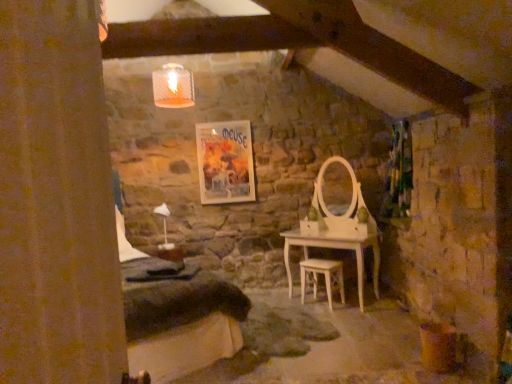
The height and width of the screenshot is (384, 512). What do you see at coordinates (225, 162) in the screenshot?
I see `matte paper poster at center` at bounding box center [225, 162].

What is the approximate width of green floral fabric curtain at right, the first curtain positioned from the back?

The width of green floral fabric curtain at right, the first curtain positioned from the back, is 13.10 inches.

This screenshot has width=512, height=384. What do you see at coordinates (56, 201) in the screenshot?
I see `brown textured curtain at left, which ranks as the 1th curtain in left-to-right order` at bounding box center [56, 201].

At what (x,y) coordinates should I click in order to perform the action: click on brown textured curtain at left, which is the second curtain in back-to-front order. Please return your answer as a coordinate pair (x, y). The width and height of the screenshot is (512, 384). Looking at the image, I should click on (56, 201).

This screenshot has height=384, width=512. Find the location of `matte paper poster at center`. matte paper poster at center is located at coordinates (225, 162).

Who is more distant, matte paper poster at center or green floral fabric curtain at right, which is counted as the 1th curtain, starting from the right?

matte paper poster at center is behind.

Is matte paper poster at center far from green floral fabric curtain at right, the first curtain positioned from the back?

Yes, matte paper poster at center and green floral fabric curtain at right, the first curtain positioned from the back, are quite far apart.

Measure the distance from matte paper poster at center to green floral fabric curtain at right, positioned as the second curtain in left-to-right order.

matte paper poster at center is 6.27 feet away from green floral fabric curtain at right, positioned as the second curtain in left-to-right order.

Between point (395, 177) and point (197, 154), which one is positioned behind?

The point (197, 154) is farther from the camera.

From the image's perspective, which object appears higher, green floral fabric curtain at right, the first curtain positioned from the back, or matte paper poster at center?

matte paper poster at center.

Are green floral fabric curtain at right, the first curtain positioned from the back, and matte paper poster at center beside each other?

No, green floral fabric curtain at right, the first curtain positioned from the back, is not with matte paper poster at center.

Between green floral fabric curtain at right, which is the 2th curtain in front-to-back order, and matte paper poster at center, which one is positioned behind?

matte paper poster at center is more distant.

Is green floral fabric curtain at right, which is counted as the 1th curtain, starting from the right, located outside light wood stool at center?

That's correct, green floral fabric curtain at right, which is counted as the 1th curtain, starting from the right, is outside of light wood stool at center.

Identify the location of stool below the green floral fabric curtain at right, which is counted as the 1th curtain, starting from the right (from a real-world perspective). This screenshot has width=512, height=384. (324, 277).

Considering the relative positions of green floral fabric curtain at right, which is counted as the 1th curtain, starting from the right, and light wood stool at center in the image provided, is green floral fabric curtain at right, which is counted as the 1th curtain, starting from the right, to the left or to the right of light wood stool at center?

Based on their positions, green floral fabric curtain at right, which is counted as the 1th curtain, starting from the right, is located to the right of light wood stool at center.

Between green floral fabric curtain at right, which is the 2th curtain in front-to-back order, and light wood stool at center, which one has more height?

Standing taller between the two is green floral fabric curtain at right, which is the 2th curtain in front-to-back order.

Locate an element on the screen. stool behind the brown textured curtain at left, which ranks as the 1th curtain in left-to-right order is located at coordinates (324, 277).

Does point (77, 146) come in front of point (312, 266)?

Yes, it is in front of point (312, 266).

Which of these two, brown textured curtain at left, which ranks as the 1th curtain in left-to-right order, or light wood stool at center, is bigger?

brown textured curtain at left, which ranks as the 1th curtain in left-to-right order.

Which object is positioned more to the left, light wood stool at center or green floral fabric curtain at right, positioned as the second curtain in left-to-right order?

Positioned to the left is light wood stool at center.

Is light wood stool at center positioned behind green floral fabric curtain at right, which is counted as the 1th curtain, starting from the right?

No, light wood stool at center is in front of green floral fabric curtain at right, which is counted as the 1th curtain, starting from the right.

Would you say light wood stool at center contains green floral fabric curtain at right, which is the 2th curtain in front-to-back order?

No, light wood stool at center does not contain green floral fabric curtain at right, which is the 2th curtain in front-to-back order.

Does matte paper poster at center have a smaller size compared to brown textured curtain at left, arranged as the second curtain when viewed from the right?

Yes.

Does point (238, 145) come behind point (46, 192)?

Yes, it is.

From a real-world perspective, relative to brown textured curtain at left, which ranks as the 1th curtain in left-to-right order, is matte paper poster at center vertically above or below?

matte paper poster at center is situated higher than brown textured curtain at left, which ranks as the 1th curtain in left-to-right order, in the real world.

How many degrees apart are the facing directions of matte paper poster at center and light wood stool at center?

41 degrees.

Is matte paper poster at center not near light wood stool at center?

matte paper poster at center is far away from light wood stool at center.

Is point (220, 142) more distant than point (314, 259)?

That is False.

At what (x,y) coordinates should I click in order to perform the action: click on picture frame above the light wood stool at center (from the image's perspective). Please return your answer as a coordinate pair (x, y). Image resolution: width=512 pixels, height=384 pixels. Looking at the image, I should click on (225, 162).

Identify the location of picture frame lying above the green floral fabric curtain at right, positioned as the second curtain in left-to-right order (from the image's perspective). (225, 162).

The height and width of the screenshot is (384, 512). I want to click on picture frame behind the green floral fabric curtain at right, which is the 2th curtain in front-to-back order, so click(225, 162).

Considering their positions, is matte paper poster at center positioned further to light wood stool at center than green floral fabric curtain at right, positioned as the second curtain in left-to-right order?

matte paper poster at center.

Considering their positions, is green floral fabric curtain at right, which is counted as the 1th curtain, starting from the right, positioned further to light wood stool at center than brown textured curtain at left, the first curtain when ordered from front to back?

The object further to light wood stool at center is brown textured curtain at left, the first curtain when ordered from front to back.

Based on their spatial positions, is matte paper poster at center or green floral fabric curtain at right, the first curtain positioned from the back, closer to brown textured curtain at left, which ranks as the 1th curtain in left-to-right order?

Based on the image, green floral fabric curtain at right, the first curtain positioned from the back, appears to be nearer to brown textured curtain at left, which ranks as the 1th curtain in left-to-right order.

Which object lies further to the anchor point green floral fabric curtain at right, the first curtain positioned from the back, brown textured curtain at left, which is the second curtain in back-to-front order, or light wood stool at center?

Among the two, brown textured curtain at left, which is the second curtain in back-to-front order, is located further to green floral fabric curtain at right, the first curtain positioned from the back.

Considering their positions, is green floral fabric curtain at right, the first curtain positioned from the back, positioned closer to brown textured curtain at left, the first curtain when ordered from front to back, than light wood stool at center?

light wood stool at center.

When comparing their distances from green floral fabric curtain at right, which is counted as the 1th curtain, starting from the right, does matte paper poster at center or light wood stool at center seem further?

matte paper poster at center.

Estimate the real-world distances between objects in this image. Which object is closer to light wood stool at center, matte paper poster at center or brown textured curtain at left, which ranks as the 1th curtain in left-to-right order?

Based on the image, matte paper poster at center appears to be nearer to light wood stool at center.

Looking at the image, which one is located further to light wood stool at center, brown textured curtain at left, which ranks as the 1th curtain in left-to-right order, or green floral fabric curtain at right, which is the 2th curtain in front-to-back order?

The object further to light wood stool at center is brown textured curtain at left, which ranks as the 1th curtain in left-to-right order.

Where is `curtain between brown textured curtain at left, which is the second curtain in back-to-front order, and matte paper poster at center in the front-back direction`? curtain between brown textured curtain at left, which is the second curtain in back-to-front order, and matte paper poster at center in the front-back direction is located at coordinates (400, 173).

You are a GUI agent. You are given a task and a screenshot of the screen. Output one action in this format:
    pyautogui.click(x=<x>, y=<y>)
    Task: Click on the stool positioned between brown textured curtain at left, arranged as the second curtain when viewed from the right, and green floral fabric curtain at right, the first curtain positioned from the back, from near to far
    This screenshot has height=384, width=512.
    Given the screenshot: What is the action you would take?
    pyautogui.click(x=324, y=277)

Where is `stool between matte paper poster at center and green floral fabric curtain at right, the first curtain positioned from the back, from left to right`? stool between matte paper poster at center and green floral fabric curtain at right, the first curtain positioned from the back, from left to right is located at coordinates (324, 277).

What are the coordinates of `stool between brown textured curtain at left, which is the second curtain in back-to-front order, and matte paper poster at center in the front-back direction` in the screenshot? It's located at (324, 277).